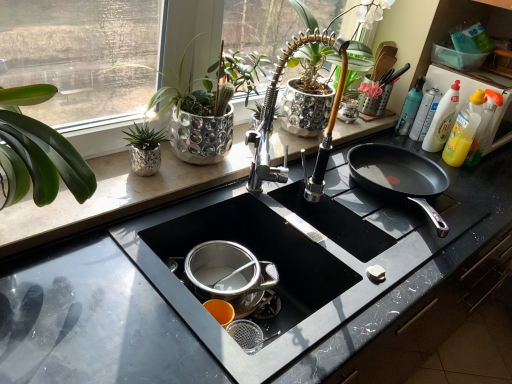
Question: Is point (206, 119) positioned closer to the camera than point (509, 104)?

Choices:
 (A) closer
 (B) farther

Answer: (A)

Question: Based on their sizes in the image, would you say silver textured pot at upper left, which ranks as the second houseplant in left-to-right order, is bigger or smaller than yellow plastic bottle at right?

Choices:
 (A) big
 (B) small

Answer: (B)

Question: Considering the real-world distances, which object is farthest from the translucent plastic bottle at upper right?

Choices:
 (A) green glossy plant at upper left, acting as the second houseplant starting from the right
 (B) black marble countertop at center
 (C) translucent plastic bottle at upper right
 (D) yellow plastic bottle at right
 (E) black granite countertop at center

Answer: (A)

Question: Which of these objects is positioned farthest from the silver textured pot at upper left, which ranks as the second houseplant in left-to-right order?

Choices:
 (A) green glossy plant at upper left, acting as the second houseplant starting from the right
 (B) translucent plastic bottle at upper right
 (C) black granite countertop at center
 (D) translucent plastic bottle at upper right
 (E) black marble countertop at center

Answer: (B)